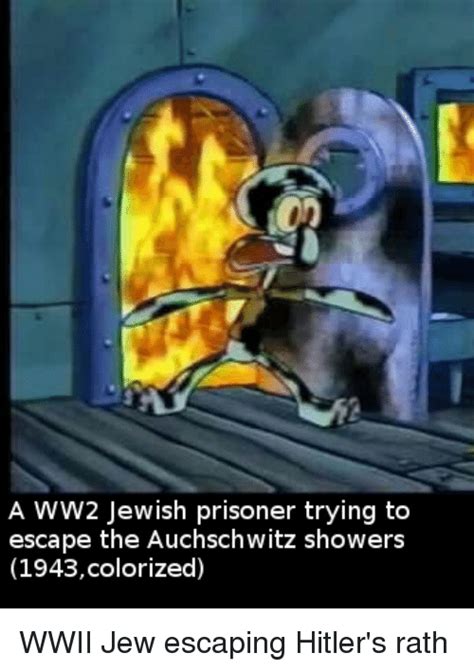
In order to click on wall in this screenshot , I will do point(49,79).